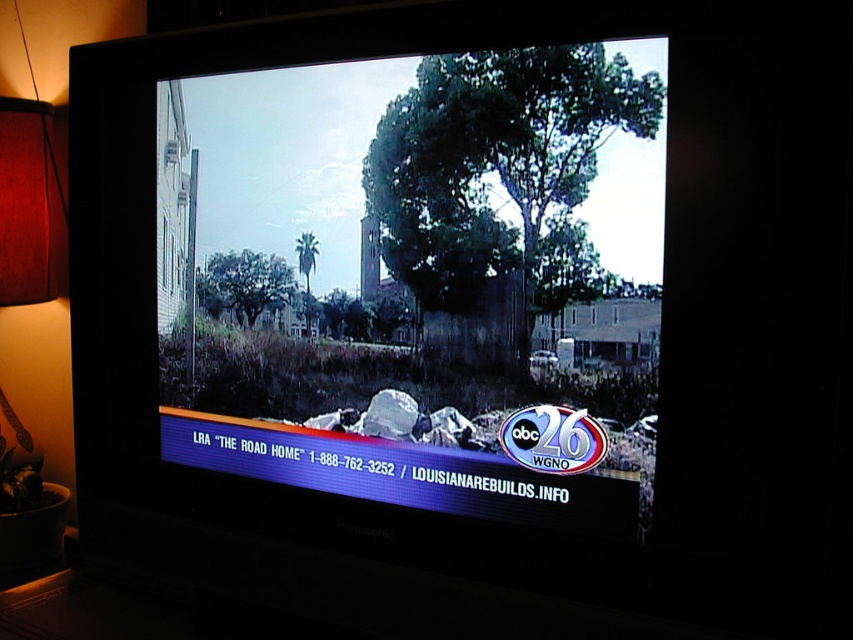
You are setting up a living room and want to place the wooden lampshade at left next to the matte black television at center. Since the television is wider, will the lampshade fit to the left of the TV without overlapping?

The matte black television at center is wider than the wooden lampshade at left. Since the television is wider, placing the lampshade to the left of it should be possible without overlapping, as the lampshade occupies less horizontal space.

You are standing in a room and want to locate the matte black television at center. According to the coordinates provided, where should you look?

You should look at point (421, 278) to find the matte black television at center.

Based on the photo, you are standing in front of the TV watching the news segment. You notice two points marked on the screen. Which point, point 1 at coordinates (x=467, y=52) or point 2 at (x=6, y=413), is closer to you?

Point 1 at coordinates (x=467, y=52) is closer to you than point 2 at (x=6, y=413).